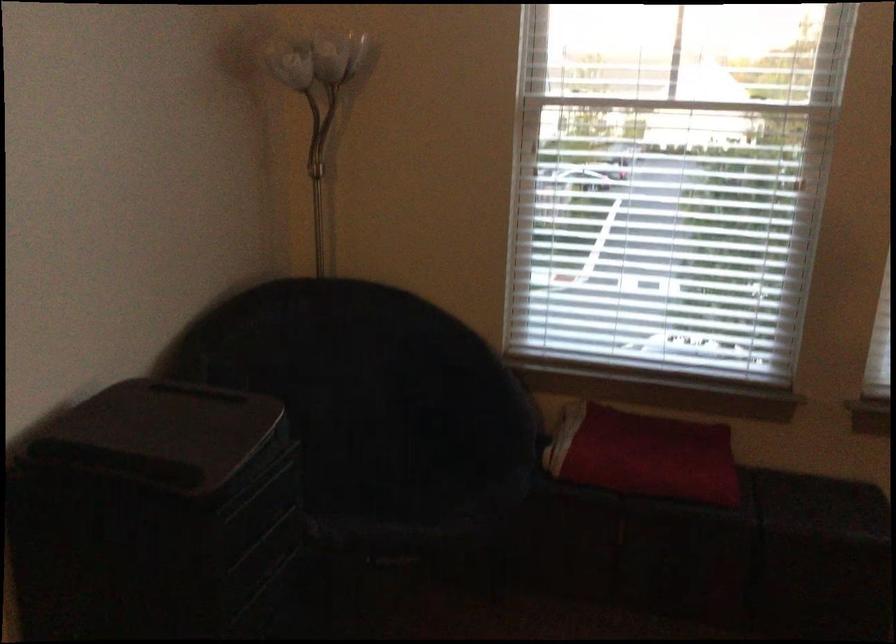
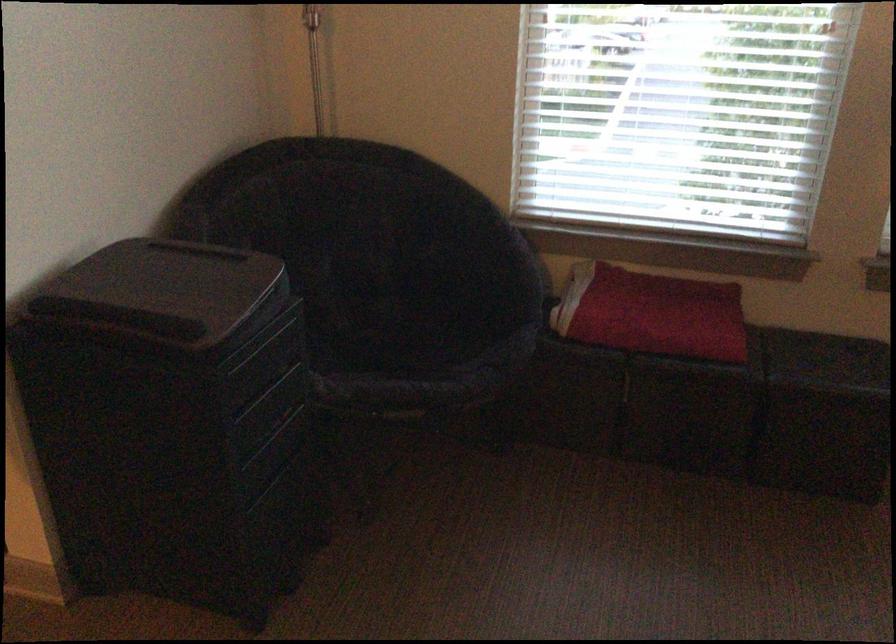
Locate, in the second image, the point that corresponds to point 385,483 in the first image.

(393, 339)